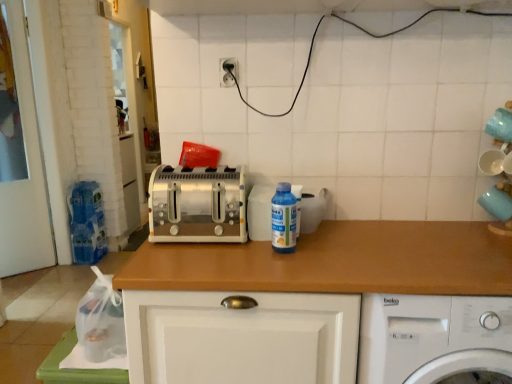
At what (x,y) coordinates should I click in order to perform the action: click on free space on the front side of satin silver toaster at center. Please return your answer as a coordinate pair (x, y). Looking at the image, I should click on (198, 258).